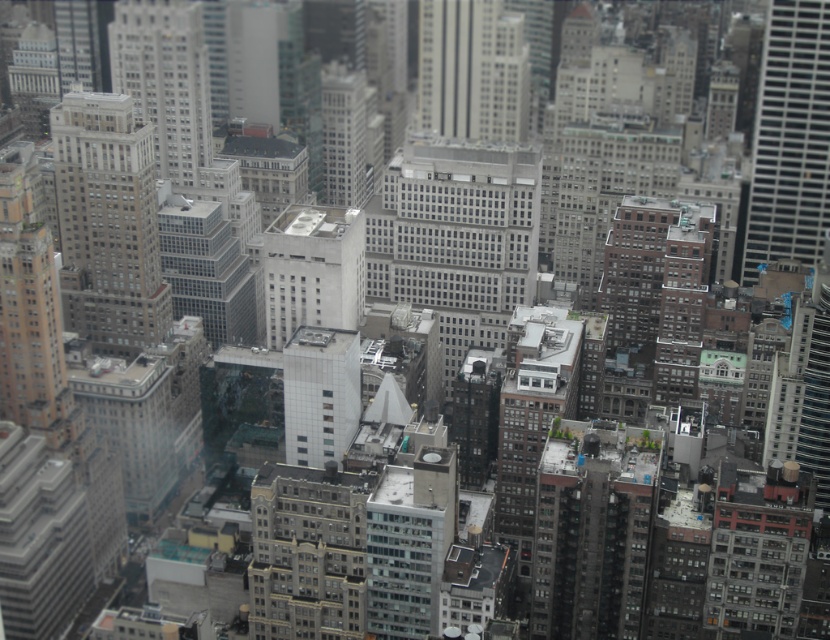
You are a drone operator flying over the city and need to deliver a package to the gray concrete building at center and the brown brick building at center. Which building should you target first if you want to reach the closer one first?

You should target the gray concrete building at center first because it is closer to the viewer than the brown brick building at center.